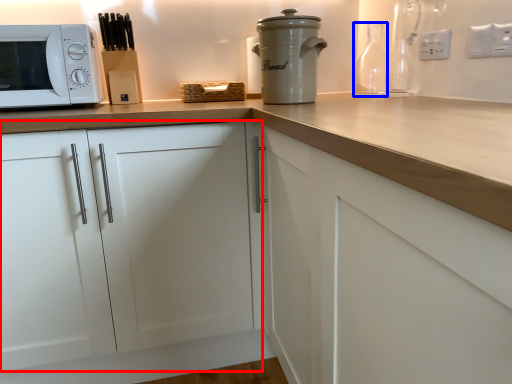
Question: Which of the following is the closest to the observer, cabinetry (highlighted by a red box) or bottle (highlighted by a blue box)?

Choices:
 (A) cabinetry
 (B) bottle

Answer: (A)